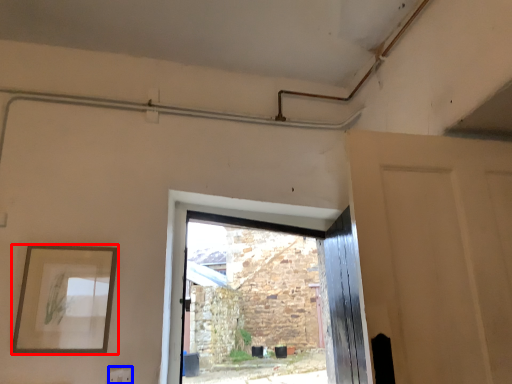
Question: Which point is closer to the camera, picture frame (highlighted by a red box) or electric outlet (highlighted by a blue box)?

Choices:
 (A) picture frame
 (B) electric outlet

Answer: (A)